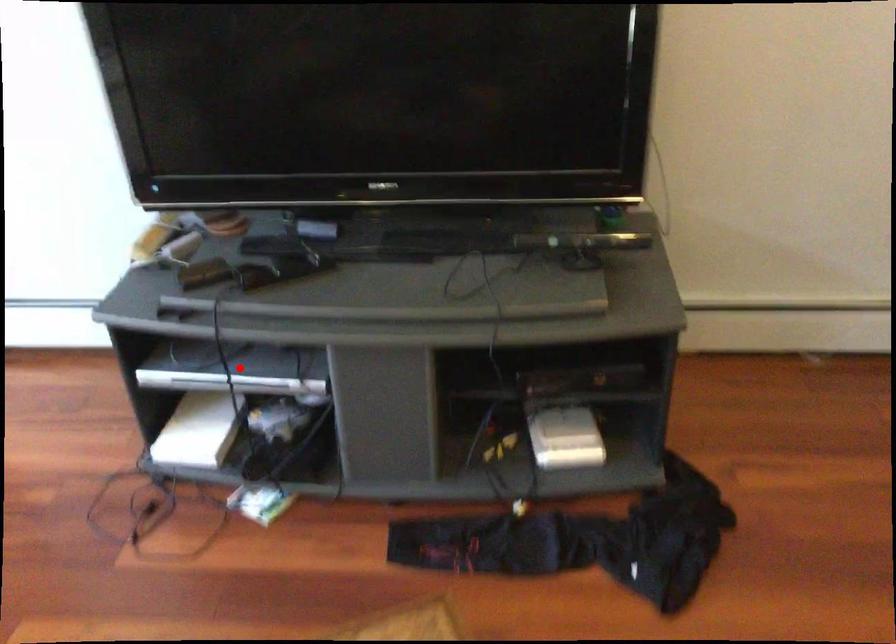
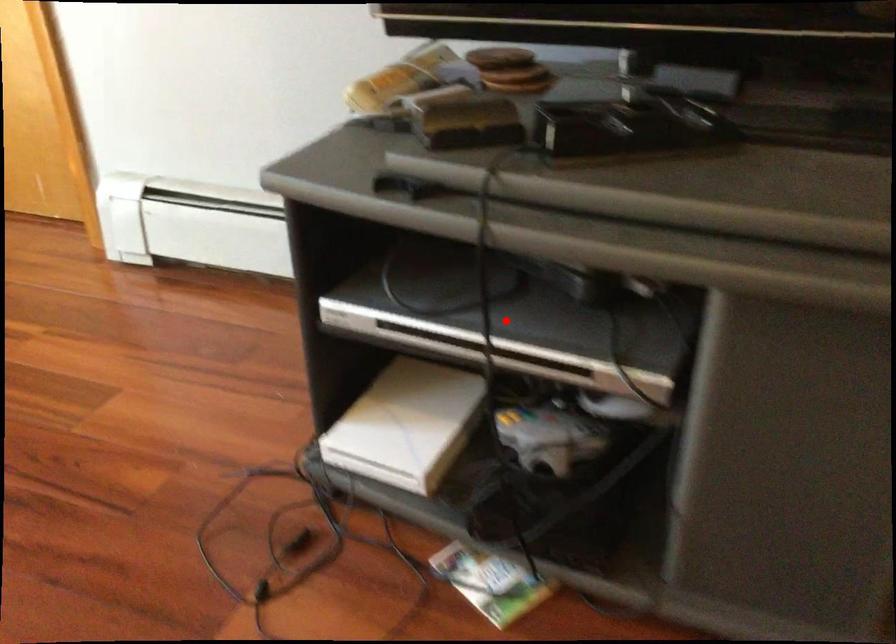
Based on the photo, I am providing you with two images of the same scene from different viewpoints. A red point is marked on the first image and another point is marked on the second image. Is the marked point in image1 the same physical position as the marked point in image2?

Yes